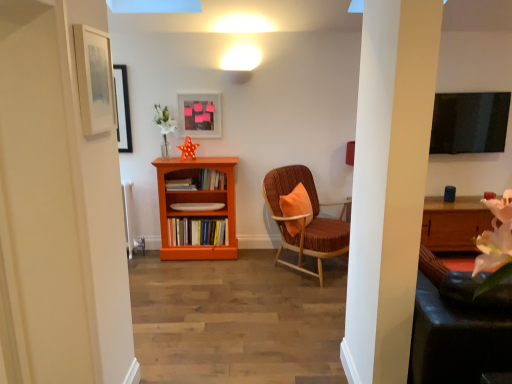
Question: Can you confirm if orange wood bookshelf at center is taller than hardcover books at center, the 3th book from the top?

Choices:
 (A) no
 (B) yes

Answer: (B)

Question: From a real-world perspective, is orange wood bookshelf at center positioned over hardcover books at center, the 3th book from the top, based on gravity?

Choices:
 (A) yes
 (B) no

Answer: (A)

Question: Does orange wood bookshelf at center turn towards hardcover books at center, which ranks as the 1th book in bottom-to-top order?

Choices:
 (A) yes
 (B) no

Answer: (A)

Question: From a real-world perspective, is orange wood bookshelf at center located beneath hardcover books at center, the 3th book from the top?

Choices:
 (A) yes
 (B) no

Answer: (B)

Question: Is orange wood bookshelf at center wider than hardcover books at center, the 3th book from the top?

Choices:
 (A) no
 (B) yes

Answer: (B)

Question: Considering the positions of matte plastic picture frame at upper center, which appears as the second picture frame when viewed from the left, and velvet brown chair with orange cushion at center in the image, is matte plastic picture frame at upper center, which appears as the second picture frame when viewed from the left, bigger or smaller than velvet brown chair with orange cushion at center?

Choices:
 (A) big
 (B) small

Answer: (B)

Question: Does point (204, 124) appear closer or farther from the camera than point (322, 244)?

Choices:
 (A) closer
 (B) farther

Answer: (B)

Question: Looking at their shapes, would you say matte plastic picture frame at upper center, which appears as the second picture frame when viewed from the left, is wider or thinner than velvet brown chair with orange cushion at center?

Choices:
 (A) thin
 (B) wide

Answer: (A)

Question: From the image's perspective, is matte plastic picture frame at upper center, which appears as the 1th picture frame when viewed from the back, positioned above or below velvet brown chair with orange cushion at center?

Choices:
 (A) below
 (B) above

Answer: (B)

Question: Considering the positions of wooden bookshelf at center, the third book in the bottom-to-top sequence, and matte plastic picture frame at upper center, which appears as the 1th picture frame when viewed from the back, in the image, is wooden bookshelf at center, the third book in the bottom-to-top sequence, wider or thinner than matte plastic picture frame at upper center, which appears as the 1th picture frame when viewed from the back,?

Choices:
 (A) wide
 (B) thin

Answer: (A)

Question: From the image's perspective, is wooden bookshelf at center, the 1th book from the top, positioned above or below matte plastic picture frame at upper center, which appears as the 1th picture frame when viewed from the back?

Choices:
 (A) below
 (B) above

Answer: (A)

Question: Considering the positions of point (211, 170) and point (210, 130), is point (211, 170) closer or farther from the camera than point (210, 130)?

Choices:
 (A) farther
 (B) closer

Answer: (B)

Question: Would you say wooden bookshelf at center, the third book in the bottom-to-top sequence, is to the left or to the right of matte plastic picture frame at upper center, which appears as the second picture frame when viewed from the left, in the picture?

Choices:
 (A) left
 (B) right

Answer: (B)

Question: Considering the positions of matte plastic picture frame at upper center, which appears as the second picture frame when viewed from the left, and hardcover books at center, which ranks as the 1th book in bottom-to-top order, in the image, is matte plastic picture frame at upper center, which appears as the second picture frame when viewed from the left, bigger or smaller than hardcover books at center, which ranks as the 1th book in bottom-to-top order,?

Choices:
 (A) small
 (B) big

Answer: (A)

Question: Visually, is matte plastic picture frame at upper center, the 1th picture frame when ordered from right to left, positioned to the left or to the right of hardcover books at center, the 3th book from the top?

Choices:
 (A) right
 (B) left

Answer: (A)